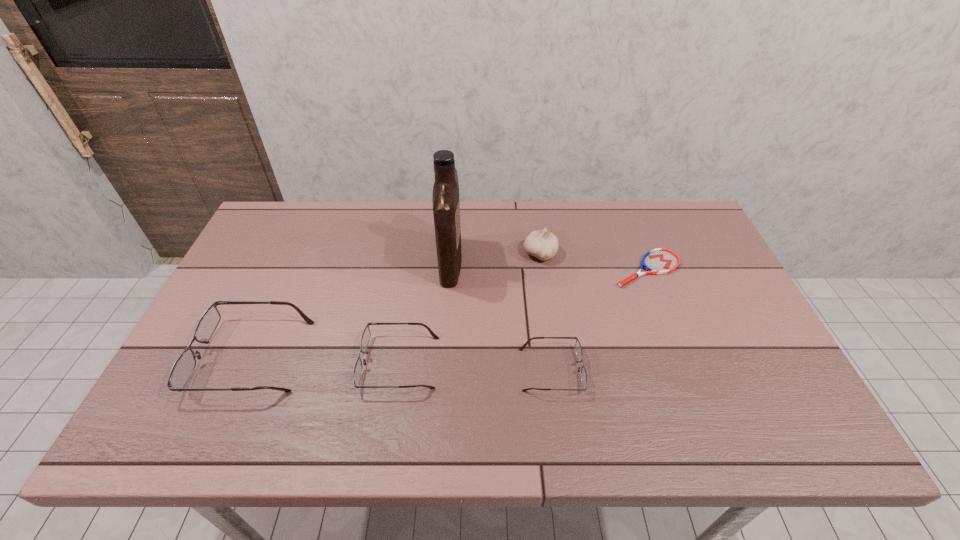
You are a GUI agent. You are given a task and a screenshot of the screen. Output one action in this format:
    pyautogui.click(x=<x>, y=<y>)
    Task: Click on the tallest spectacles
    
    Given the screenshot: What is the action you would take?
    pyautogui.click(x=184, y=366)

Where is `the third tallest object`? the third tallest object is located at coordinates (184, 366).

The image size is (960, 540). Find the location of `the second spectacles from right to left`. the second spectacles from right to left is located at coordinates (365, 338).

You are a GUI agent. You are given a task and a screenshot of the screen. Output one action in this format:
    pyautogui.click(x=<x>, y=<y>)
    Task: Click on the second shortest spectacles
    The width and height of the screenshot is (960, 540).
    Given the screenshot: What is the action you would take?
    pyautogui.click(x=365, y=338)

The height and width of the screenshot is (540, 960). I want to click on the second shortest object, so click(578, 348).

The height and width of the screenshot is (540, 960). I want to click on the shortest spectacles, so click(578, 348).

The height and width of the screenshot is (540, 960). Identify the location of the shortest object. (657, 261).

I want to click on the rightmost object, so click(x=657, y=261).

Identify the location of liquor. This screenshot has height=540, width=960. (446, 203).

This screenshot has height=540, width=960. Find the location of `the fifth shortest object`. the fifth shortest object is located at coordinates coord(542,244).